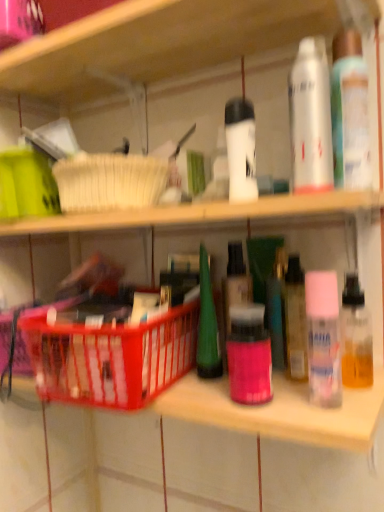
Question: Does pink matte bottle at center, positioned as the 4th toiletry in top-to-bottom order, have a lesser height compared to translucent plastic basket at center?

Choices:
 (A) yes
 (B) no

Answer: (A)

Question: Could translucent plastic basket at center be considered to be inside pink matte bottle at center, positioned as the 4th toiletry in top-to-bottom order?

Choices:
 (A) yes
 (B) no

Answer: (B)

Question: Does pink matte bottle at center, arranged as the 1th toiletry when ordered from the bottom, have a larger size compared to translucent plastic basket at center?

Choices:
 (A) yes
 (B) no

Answer: (B)

Question: Is pink matte bottle at center, positioned as the 4th toiletry in top-to-bottom order, taller than translucent plastic basket at center?

Choices:
 (A) yes
 (B) no

Answer: (B)

Question: Is pink matte bottle at center, arranged as the 1th toiletry when ordered from the bottom, aimed at translucent plastic basket at center?

Choices:
 (A) no
 (B) yes

Answer: (A)

Question: Is point (309, 388) positioned closer to the camera than point (334, 175)?

Choices:
 (A) farther
 (B) closer

Answer: (A)

Question: Is pink matte spray can at right, acting as the 2th toiletry starting from the bottom, to the left or to the right of translucent plastic spray can at upper right, placed as the 1th toiletry when sorted from top to bottom, in the image?

Choices:
 (A) right
 (B) left

Answer: (B)

Question: Looking at the image, does pink matte spray can at right, acting as the 3th toiletry starting from the top, seem bigger or smaller compared to translucent plastic spray can at upper right, which is the fourth toiletry in bottom-to-top order?

Choices:
 (A) big
 (B) small

Answer: (B)

Question: Relative to translucent plastic spray can at upper right, which is the fourth toiletry in bottom-to-top order, is pink matte spray can at right, acting as the 3th toiletry starting from the top, in front or behind?

Choices:
 (A) front
 (B) behind

Answer: (A)

Question: Is point (233, 394) positioned closer to the camera than point (304, 89)?

Choices:
 (A) farther
 (B) closer

Answer: (A)

Question: In the image, is pink matte bottle at center, arranged as the 1th toiletry when ordered from the bottom, on the left side or the right side of white matte spray can at upper right?

Choices:
 (A) left
 (B) right

Answer: (A)

Question: Looking at their shapes, would you say pink matte bottle at center, arranged as the 1th toiletry when ordered from the bottom, is wider or thinner than white matte spray can at upper right?

Choices:
 (A) thin
 (B) wide

Answer: (B)

Question: Is pink matte bottle at center, positioned as the 4th toiletry in top-to-bottom order, in front of or behind white matte spray can at upper right in the image?

Choices:
 (A) front
 (B) behind

Answer: (B)

Question: Relative to white matte spray can at upper center, acting as the third toiletry starting from the bottom, is white matte spray can at upper right in front or behind?

Choices:
 (A) behind
 (B) front

Answer: (B)

Question: From a real-world perspective, is white matte spray can at upper right physically located above or below white matte spray can at upper center, which appears as the second toiletry when viewed from the top?

Choices:
 (A) above
 (B) below

Answer: (A)